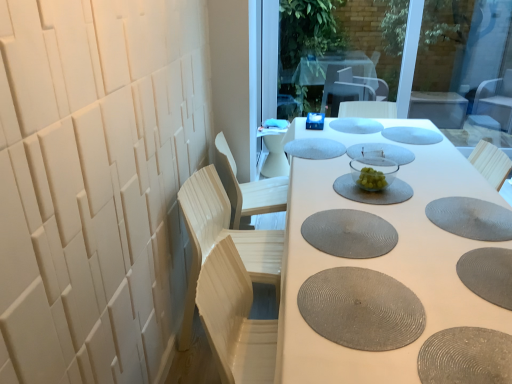
Locate an element on the screen. The image size is (512, 384). vacant region under gray textured placemat at center, which is counted as the fourth manhole cover, starting from the front (from a real-world perspective) is located at coordinates (346, 229).